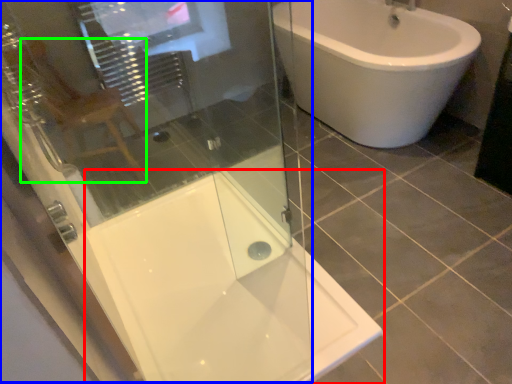
Question: Which object is positioned farthest from bath (highlighted by a red box)? Select from screen door (highlighted by a blue box) and gray (highlighted by a green box).

Choices:
 (A) screen door
 (B) gray

Answer: (B)